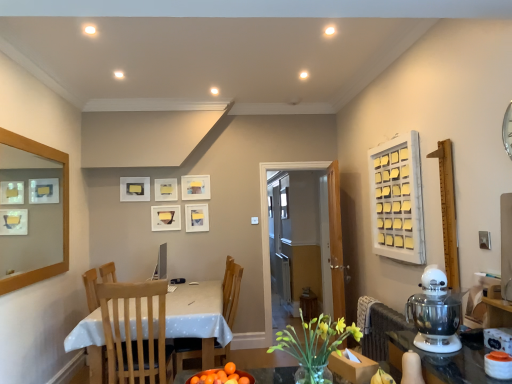
How much space does matte white picture frame at upper center, arranged as the 4th picture frame when viewed from the left, occupy vertically?

The height of matte white picture frame at upper center, arranged as the 4th picture frame when viewed from the left, is 11.54 inches.

I want to click on transparent glass door at center, so click(267, 226).

The width and height of the screenshot is (512, 384). What do you see at coordinates (397, 199) in the screenshot?
I see `white wooden frame at upper right, placed as the second window when sorted from back to front` at bounding box center [397, 199].

What is the approximate height of white wooden frame at upper right, acting as the first window starting from the right?

white wooden frame at upper right, acting as the first window starting from the right, is 37.18 inches tall.

The image size is (512, 384). In order to click on matte white picture frame at upper center, arranged as the fourth picture frame when viewed from the right in this screenshot , I will do `click(166, 189)`.

Is white wooden frame at upper right, acting as the first window starting from the right, positioned far away from matte white picture frame at center, which is counted as the first picture frame, starting from the right?

That's right, there is a large distance between white wooden frame at upper right, acting as the first window starting from the right, and matte white picture frame at center, which is counted as the first picture frame, starting from the right.

Is white wooden frame at upper right, acting as the first window starting from the right, looking in the opposite direction of matte white picture frame at center, arranged as the fifth picture frame when viewed from the left?

No.

Who is taller, white wooden frame at upper right, acting as the first window starting from the right, or matte white picture frame at center, which is counted as the first picture frame, starting from the right?

With more height is white wooden frame at upper right, acting as the first window starting from the right.

Looking at this image, is white wooden frame at upper right, placed as the 1th window when sorted from front to back, inside the boundaries of matte white picture frame at center, arranged as the fifth picture frame when viewed from the left, or outside?

white wooden frame at upper right, placed as the 1th window when sorted from front to back, is not inside matte white picture frame at center, arranged as the fifth picture frame when viewed from the left, it's outside.

From a real-world perspective, is white dotted fabric at lower left above or below wooden chair at center, which is counted as the second chair, starting from the front?

white dotted fabric at lower left is below wooden chair at center, which is counted as the second chair, starting from the front.

Who is smaller, white dotted fabric at lower left or wooden chair at center, the first chair positioned from the back?

wooden chair at center, the first chair positioned from the back, is smaller.

Which point is more distant from viewer, (187, 294) or (187, 350)?

Positioned behind is point (187, 294).

From the image's perspective, is white dotted fabric at lower left over wooden chair at center, the first chair positioned from the back?

No, from the image's perspective, white dotted fabric at lower left is not over wooden chair at center, the first chair positioned from the back.

In the scene shown: Between yellow glass vase at center and wooden chair at center, the first chair positioned from the back, which one has more height?

Standing taller between the two is wooden chair at center, the first chair positioned from the back.

Is yellow glass vase at center wider than wooden chair at center, the first chair positioned from the back?

Incorrect, the width of yellow glass vase at center does not surpass that of wooden chair at center, the first chair positioned from the back.

Considering the points (310, 333) and (178, 351), which point is in front, point (310, 333) or point (178, 351)?

Point (310, 333)

Is yellow glass vase at center smaller than wooden chair at center, which is counted as the second chair, starting from the front?

Correct, yellow glass vase at center occupies less space than wooden chair at center, which is counted as the second chair, starting from the front.

Considering the positions of objects orange matte bowl at lower center and white wooden frame at upper right, placed as the second window when sorted from back to front, in the image provided, who is in front, orange matte bowl at lower center or white wooden frame at upper right, placed as the second window when sorted from back to front,?

Positioned in front is orange matte bowl at lower center.

From a real-world perspective, which is physically above, orange matte bowl at lower center or white wooden frame at upper right, placed as the second window when sorted from back to front?

white wooden frame at upper right, placed as the second window when sorted from back to front, is physically above.

Looking at this image, considering the relative sizes of orange matte bowl at lower center and white wooden frame at upper right, placed as the second window when sorted from back to front, in the image provided, is orange matte bowl at lower center smaller than white wooden frame at upper right, placed as the second window when sorted from back to front,?

Yes.

Is point (229, 363) positioned after point (376, 194)?

That is False.

Does white matte bulletin board at right have a smaller size compared to matte white picture frame at center, arranged as the fifth picture frame when viewed from the left?

Incorrect, white matte bulletin board at right is not smaller in size than matte white picture frame at center, arranged as the fifth picture frame when viewed from the left.

Which is behind, point (439, 178) or point (196, 216)?

The point (196, 216) is farther from the camera.

From a real-world perspective, relative to matte white picture frame at center, which is counted as the first picture frame, starting from the right, is white matte bulletin board at right vertically above or below?

white matte bulletin board at right is situated lower than matte white picture frame at center, which is counted as the first picture frame, starting from the right, in the real world.

From the image's perspective, relative to white dotted fabric at lower left, is matte white picture frame at upper center, arranged as the fourth picture frame when viewed from the right, above or below?

From the image's perspective, matte white picture frame at upper center, arranged as the fourth picture frame when viewed from the right, appears above white dotted fabric at lower left.

Is matte white picture frame at upper center, arranged as the fourth picture frame when viewed from the right, placed right next to white dotted fabric at lower left?

No, matte white picture frame at upper center, arranged as the fourth picture frame when viewed from the right, is not in contact with white dotted fabric at lower left.

In the scene shown: Relative to white dotted fabric at lower left, is matte white picture frame at upper center, arranged as the fourth picture frame when viewed from the right, in front or behind?

matte white picture frame at upper center, arranged as the fourth picture frame when viewed from the right, is behind white dotted fabric at lower left.

Is the position of orange matte bowl at lower center more distant than that of white dotted fabric at lower left?

No, orange matte bowl at lower center is closer to the viewer.

Consider the image. Can white dotted fabric at lower left be found inside orange matte bowl at lower center?

No, white dotted fabric at lower left is not surrounded by orange matte bowl at lower center.

Does orange matte bowl at lower center have a larger size compared to white dotted fabric at lower left?

Incorrect, orange matte bowl at lower center is not larger than white dotted fabric at lower left.

Could you tell me if orange matte bowl at lower center is facing white dotted fabric at lower left?

No, orange matte bowl at lower center is not turned towards white dotted fabric at lower left.

From the white wooden frame at upper right, placed as the second window when sorted from back to front, count the 1st picture frame to the left and point to it. Please provide its 2D coordinates.

[(197, 217)]

This screenshot has height=384, width=512. What are the coordinates of `chair that is the 1st object located above the white dotted fabric at lower left (from the image's perspective)` in the screenshot? It's located at (231, 290).

Estimate the real-world distances between objects in this image. Which object is closer to white wooden frame at upper right, placed as the second window when sorted from back to front, transparent glass door at center or white dotted fabric at lower left?

Based on the image, white dotted fabric at lower left appears to be nearer to white wooden frame at upper right, placed as the second window when sorted from back to front.

Estimate the real-world distances between objects in this image. Which object is closer to transparent glass door at center, yellow glass vase at center or matte white picture frame at upper center, which is counted as the 5th picture frame, starting from the right?

matte white picture frame at upper center, which is counted as the 5th picture frame, starting from the right, is positioned closer to the anchor transparent glass door at center.

From the image, which object appears to be farther from matte white picture frame at upper center, the 3th picture frame viewed from the right, matte white picture frame at upper center, arranged as the 4th picture frame when viewed from the left, or orange matte bowl at lower center?

orange matte bowl at lower center is further to matte white picture frame at upper center, the 3th picture frame viewed from the right.

Based on their spatial positions, is transparent glass door at center or white glossy stand mixer at right further from white wooden frame at upper right, acting as the first window starting from the right?

The object further to white wooden frame at upper right, acting as the first window starting from the right, is transparent glass door at center.

Estimate the real-world distances between objects in this image. Which object is further from white matte bulletin board at right, white dotted fabric at lower left or matte white picture frame at upper center, the 3th picture frame viewed from the right?

matte white picture frame at upper center, the 3th picture frame viewed from the right, lies further to white matte bulletin board at right than the other object.

Which object lies nearer to the anchor point matte white picture frame at upper center, arranged as the 4th picture frame when viewed from the left, wooden chair at center, which is counted as the second chair, starting from the front, or matte white picture frame at upper center, the first picture frame in the left-to-right sequence?

matte white picture frame at upper center, the first picture frame in the left-to-right sequence, is closer to matte white picture frame at upper center, arranged as the 4th picture frame when viewed from the left.

From the image, which object appears to be farther from matte white picture frame at upper center, which is counted as the 5th picture frame, starting from the right, orange matte bowl at lower center or white matte bulletin board at right?

white matte bulletin board at right lies further to matte white picture frame at upper center, which is counted as the 5th picture frame, starting from the right, than the other object.

Which object lies nearer to the anchor point yellow glass vase at center, white matte bulletin board at right or matte white picture frame at center, arranged as the fifth picture frame when viewed from the left?

white matte bulletin board at right lies closer to yellow glass vase at center than the other object.

Identify the location of tablecloth positioned between wooden-framed mirror at upper left and matte white picture frame at center, arranged as the fifth picture frame when viewed from the left, from near to far. The height and width of the screenshot is (384, 512). (197, 312).

Locate an element on the screen. This screenshot has height=384, width=512. chair between yellow glass vase at center and white dotted fabric at lower left from front to back is located at coordinates (134, 329).

In order to click on orange positioned between yellow glass vase at center and matte white picture frame at upper center, the 3th picture frame viewed from the right, from near to far in this screenshot , I will do `click(221, 376)`.

The width and height of the screenshot is (512, 384). In order to click on picture frame between yellow glass vase at center and matte white picture frame at upper center, which is counted as the 5th picture frame, starting from the right, along the z-axis in this screenshot , I will do [165, 218].